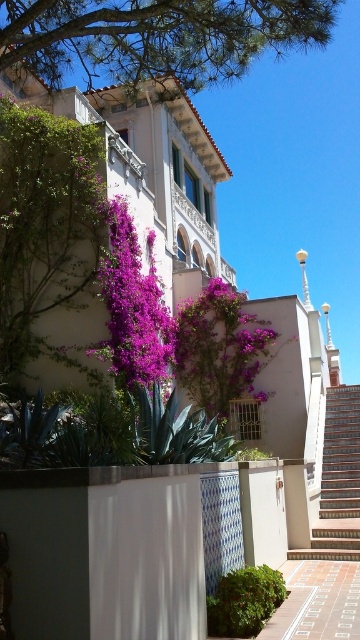
Which is above, green leafy tree at upper center or terracotta tiled stairs at center?

Positioned higher is green leafy tree at upper center.

Does green leafy tree at upper center have a larger size compared to terracotta tiled stairs at center?

Yes.

What are the coordinates of `green leafy tree at upper center` in the screenshot? It's located at (156, 36).

Which is more to the left, green leafy tree at upper center or purple leafy plant at upper left?

Positioned to the left is purple leafy plant at upper left.

How much distance is there between green leafy tree at upper center and purple leafy plant at upper left?

The distance of green leafy tree at upper center from purple leafy plant at upper left is 5.71 meters.

Between point (132, 20) and point (12, 234), which one is positioned behind?

Positioned behind is point (12, 234).

Find the location of a particular element. This screenshot has width=360, height=640. green leafy tree at upper center is located at coordinates (156, 36).

Can you confirm if terracotta tiled stairs at center is taller than green leafy bush at lower center?

Indeed, terracotta tiled stairs at center has a greater height compared to green leafy bush at lower center.

Can you confirm if terracotta tiled stairs at center is positioned to the right of green leafy bush at lower center?

Correct, you'll find terracotta tiled stairs at center to the right of green leafy bush at lower center.

Does point (356, 396) come closer to viewer compared to point (227, 582)?

No, it is behind (227, 582).

The height and width of the screenshot is (640, 360). Find the location of `terracotta tiled stairs at center`. terracotta tiled stairs at center is located at coordinates (338, 481).